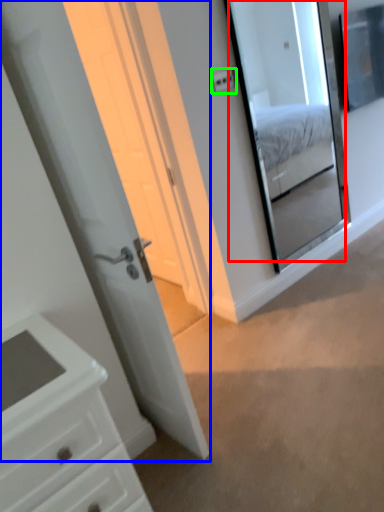
Question: Estimate the real-world distances between objects in this image. Which object is farther from mirror (highlighted by a red box), door (highlighted by a blue box) or light switch (highlighted by a green box)?

Choices:
 (A) door
 (B) light switch

Answer: (A)